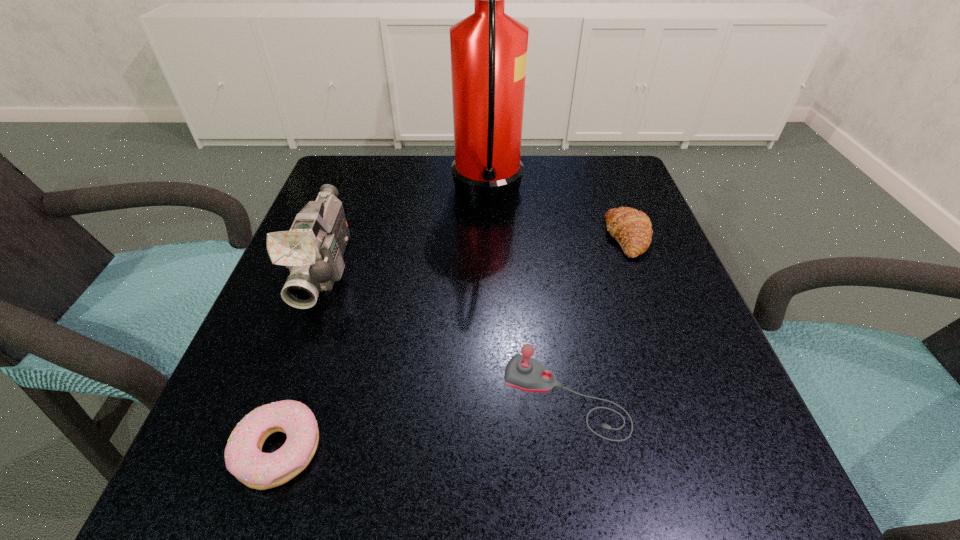
The height and width of the screenshot is (540, 960). I want to click on blank area in the image that satisfies the following two spatial constraints: 1. at the spray nozzle of the crescent roll; 2. on the left side of the fire extinguisher, so click(x=488, y=237).

What are the coordinates of `vacant area in the image that satisfies the following two spatial constraints: 1. at the spray nozzle of the fire extinguisher; 2. on the right side of the crescent roll` in the screenshot? It's located at (x=488, y=237).